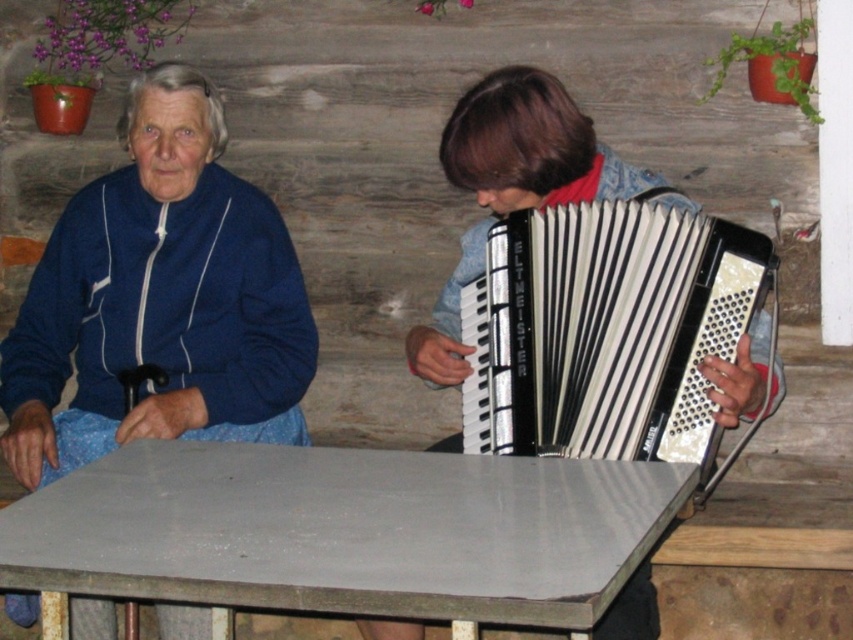
You are a furniture designer evaluating the placement of items in this rustic cabin scene. The smooth gray table at center and the black plastic accordion at right are both present. Based on their heights, which object would require a taller stand or support structure to be displayed properly?

The black plastic accordion at right requires a taller stand or support structure because the smooth gray table at center is not as tall as it, meaning the accordion is taller than the table.

You are designing a seating arrangement for a small concert in this rustic cabin. The smooth gray table at center and the metallic accordion at center are both in the way of the audience. Which object should you move to ensure there is enough legroom for the audience members?

The smooth gray table at center is shorter than the metallic accordion at center, so moving the metallic accordion at center would free up more space for legroom since it is taller and might obstruct the audience more.